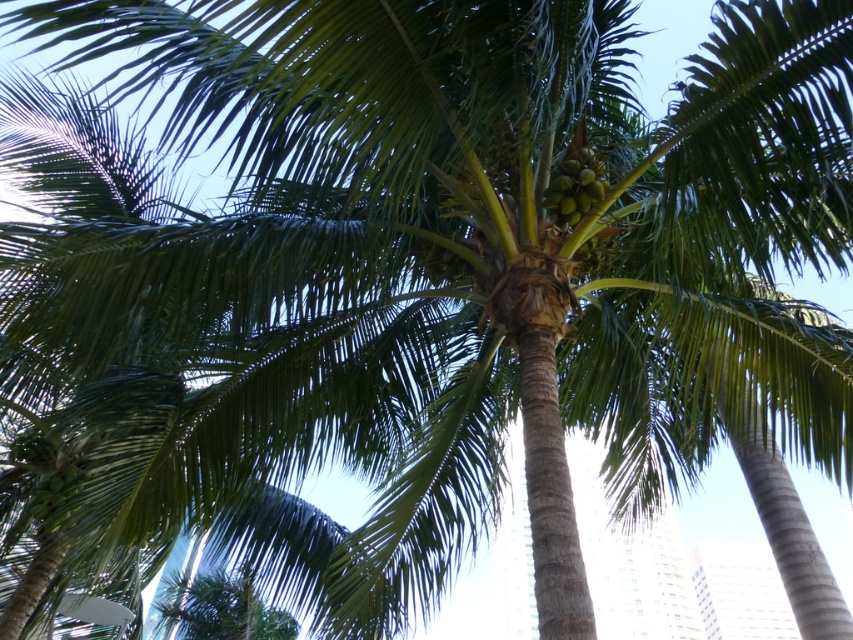
Question: Which object is closer to the camera taking this photo?

Choices:
 (A) green matte coconuts at lower left
 (B) green matte coconuts at center

Answer: (B)

Question: Can you confirm if green matte coconuts at center is positioned below green matte coconuts at lower left?

Choices:
 (A) no
 (B) yes

Answer: (A)

Question: Does green matte coconuts at center have a lesser width compared to green matte coconuts at lower left?

Choices:
 (A) no
 (B) yes

Answer: (B)

Question: Which of the following is the farthest from the observer?

Choices:
 (A) (561, 168)
 (B) (53, 516)

Answer: (B)

Question: Does green matte coconuts at center lie in front of green matte coconuts at lower left?

Choices:
 (A) no
 (B) yes

Answer: (B)